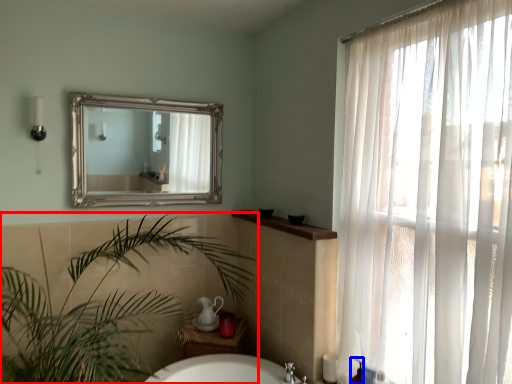
Question: Which point is further to the camera, houseplant (highlighted by a red box) or toiletry (highlighted by a blue box)?

Choices:
 (A) houseplant
 (B) toiletry

Answer: (B)